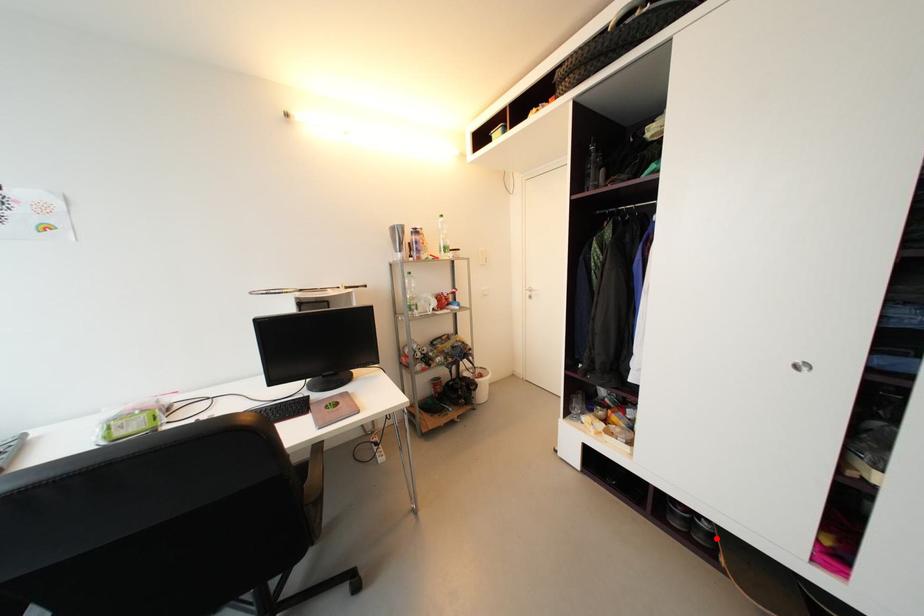
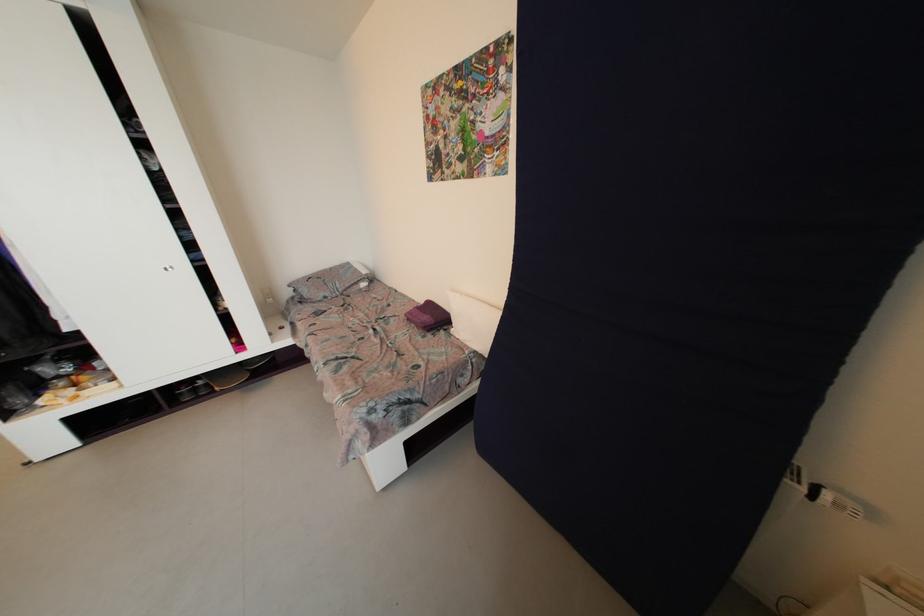
Find the pixel in the second image that matches the highlighted location in the first image.

(212, 387)